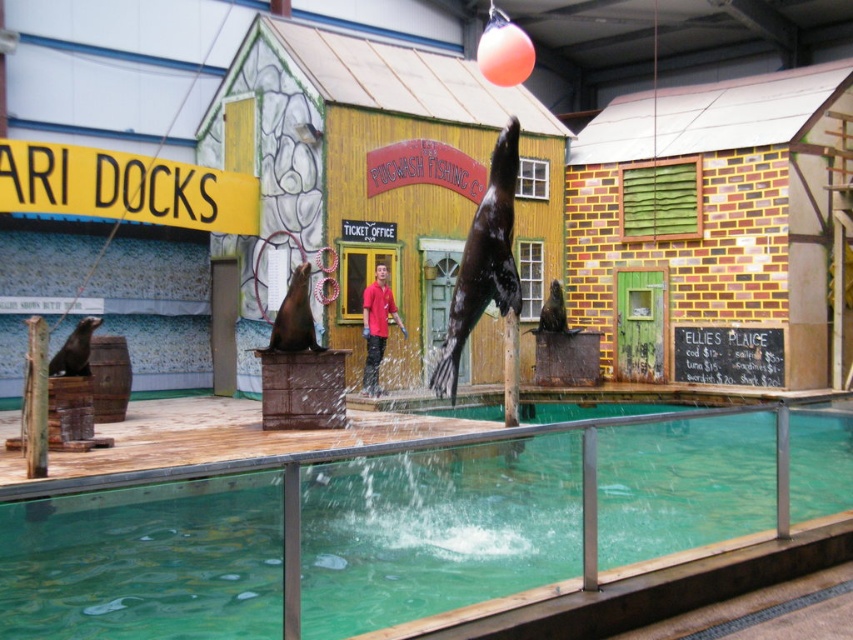
Question: Can you confirm if orange rubber balloon at upper center is thinner than red matte shirt at center?

Choices:
 (A) no
 (B) yes

Answer: (B)

Question: Which object is closer to the camera taking this photo?

Choices:
 (A) orange rubber balloon at upper center
 (B) green glass water at center

Answer: (B)

Question: Is green glass water at center wider than orange rubber balloon at upper center?

Choices:
 (A) no
 (B) yes

Answer: (B)

Question: Is orange rubber balloon at upper center smaller than red matte shirt at center?

Choices:
 (A) no
 (B) yes

Answer: (B)

Question: Among these points, which one is nearest to the camera?

Choices:
 (A) (39, 564)
 (B) (369, 368)
 (C) (503, 35)

Answer: (A)

Question: Which object is positioned closest to the green glass water at center?

Choices:
 (A) red matte shirt at center
 (B) orange rubber balloon at upper center

Answer: (A)